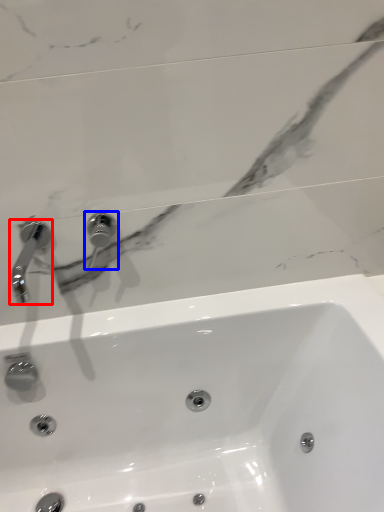
Question: Which object is further to the camera taking this photo, tap (highlighted by a red box) or tap (highlighted by a blue box)?

Choices:
 (A) tap
 (B) tap

Answer: (B)